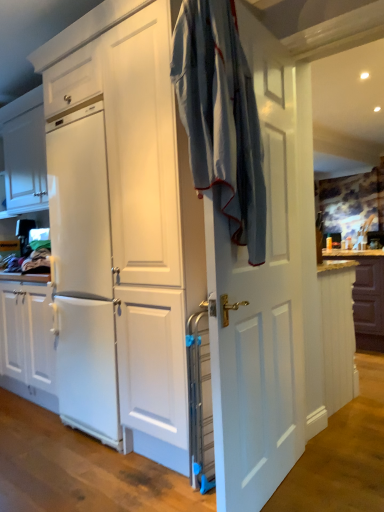
Question: Is white matte cabinet at right not within light blue fabric at center?

Choices:
 (A) no
 (B) yes

Answer: (B)

Question: Is white matte cabinet at right oriented away from light blue fabric at center?

Choices:
 (A) yes
 (B) no

Answer: (B)

Question: Does white matte cabinet at right have a lesser height compared to light blue fabric at center?

Choices:
 (A) no
 (B) yes

Answer: (B)

Question: Is light blue fabric at center completely or partially inside white matte cabinet at right?

Choices:
 (A) yes
 (B) no

Answer: (B)

Question: Does white matte cabinet at right have a greater height compared to light blue fabric at center?

Choices:
 (A) no
 (B) yes

Answer: (A)

Question: Is white matte cabinet at right positioned far away from light blue fabric at center?

Choices:
 (A) yes
 (B) no

Answer: (A)

Question: Is white matte cabinet at right completely or partially inside light blue fabric at center?

Choices:
 (A) no
 (B) yes

Answer: (A)

Question: Can you confirm if light blue fabric at center is positioned to the right of white matte cabinet at right?

Choices:
 (A) no
 (B) yes

Answer: (A)

Question: Is light blue fabric at center bigger than white matte cabinet at right?

Choices:
 (A) yes
 (B) no

Answer: (B)

Question: From a real-world perspective, is light blue fabric at center physically above white matte cabinet at right?

Choices:
 (A) no
 (B) yes

Answer: (B)

Question: From a real-world perspective, is light blue fabric at center beneath white matte cabinet at right?

Choices:
 (A) no
 (B) yes

Answer: (A)

Question: Is light blue fabric at center wider than white matte cabinet at right?

Choices:
 (A) no
 (B) yes

Answer: (B)

Question: Considering the relative sizes of brown wood countertop at right and white matte cabinet at right in the image provided, is brown wood countertop at right shorter than white matte cabinet at right?

Choices:
 (A) no
 (B) yes

Answer: (B)